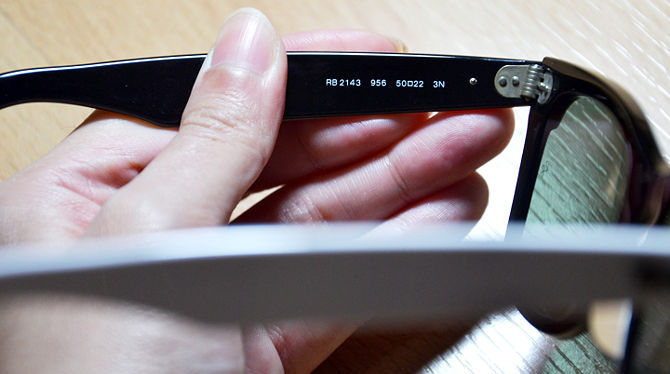
Image resolution: width=670 pixels, height=374 pixels. Find the location of `hinge`. hinge is located at coordinates (529, 78).